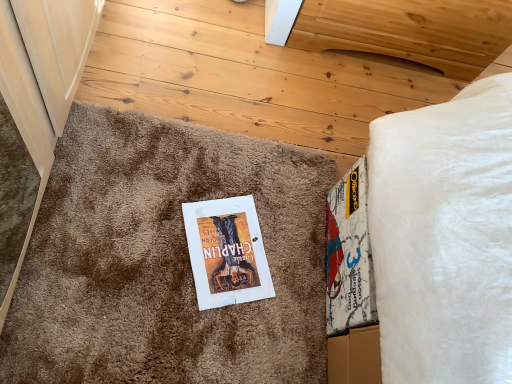
Question: Does brown shaggy carpet at center come in front of white paper book at center?

Choices:
 (A) yes
 (B) no

Answer: (A)

Question: From a real-world perspective, is brown shaggy carpet at center located higher than white paper book at center?

Choices:
 (A) yes
 (B) no

Answer: (A)

Question: Is brown shaggy carpet at center at the right side of white paper book at center?

Choices:
 (A) no
 (B) yes

Answer: (A)

Question: Is brown shaggy carpet at center positioned with its back to white paper book at center?

Choices:
 (A) no
 (B) yes

Answer: (B)

Question: Does brown shaggy carpet at center have a greater height compared to white paper book at center?

Choices:
 (A) no
 (B) yes

Answer: (B)

Question: In the image, is natural wood headboard at upper center positioned in front of or behind white paper book at center?

Choices:
 (A) front
 (B) behind

Answer: (B)

Question: Is point (268, 6) positioned closer to the camera than point (252, 208)?

Choices:
 (A) farther
 (B) closer

Answer: (A)

Question: Is natural wood headboard at upper center bigger or smaller than white paper book at center?

Choices:
 (A) small
 (B) big

Answer: (B)

Question: Would you say natural wood headboard at upper center is to the left or to the right of white paper book at center in the picture?

Choices:
 (A) right
 (B) left

Answer: (A)

Question: Would you say natural wood headboard at upper center is inside or outside brown shaggy carpet at center?

Choices:
 (A) inside
 (B) outside

Answer: (B)

Question: Considering the positions of natural wood headboard at upper center and brown shaggy carpet at center in the image, is natural wood headboard at upper center wider or thinner than brown shaggy carpet at center?

Choices:
 (A) wide
 (B) thin

Answer: (B)

Question: Considering the positions of point (436, 26) and point (15, 329), is point (436, 26) closer or farther from the camera than point (15, 329)?

Choices:
 (A) closer
 (B) farther

Answer: (B)

Question: In the image, is natural wood headboard at upper center on the left side or the right side of brown shaggy carpet at center?

Choices:
 (A) right
 (B) left

Answer: (A)

Question: Is brown shaggy carpet at center inside the boundaries of white paper book at center, or outside?

Choices:
 (A) inside
 (B) outside

Answer: (B)

Question: Considering the positions of brown shaggy carpet at center and white paper book at center in the image, is brown shaggy carpet at center taller or shorter than white paper book at center?

Choices:
 (A) tall
 (B) short

Answer: (A)